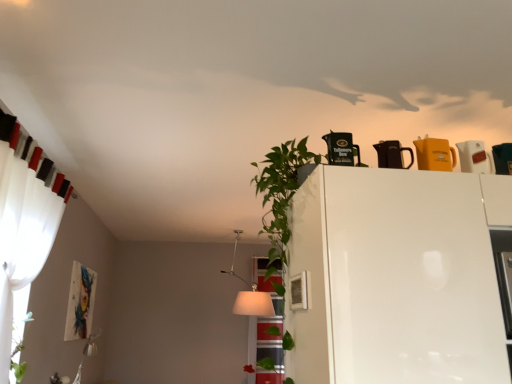
Question: Choose the correct answer: Is translucent glass window at center inside matte black kettle at upper center, which is counted as the 2th appliance, starting from the left, or outside it?

Choices:
 (A) inside
 (B) outside

Answer: (B)

Question: In terms of size, does translucent glass window at center appear bigger or smaller than matte black kettle at upper center, which is counted as the 2th appliance, starting from the left?

Choices:
 (A) big
 (B) small

Answer: (A)

Question: Considering the real-world distances, which object is farthest from the black plastic coffee pot at upper center, arranged as the 4th appliance when viewed from the right?

Choices:
 (A) matte black kettle at upper center, which ranks as the 3th appliance in right-to-left order
 (B) white sheer curtain at left
 (C) white glossy fridge at upper center
 (D) white glossy pitcher at upper right, placed as the fourth appliance when sorted from left to right
 (E) yellow matte pitcher at upper right, acting as the second appliance starting from the right

Answer: (B)

Question: Which of these objects is positioned farthest from the white sheer curtain at left?

Choices:
 (A) white glossy pitcher at upper right, placed as the fourth appliance when sorted from left to right
 (B) white fabric lampshade at center
 (C) translucent glass window at center
 (D) matte black kettle at upper center, which ranks as the 3th appliance in right-to-left order
 (E) yellow matte pitcher at upper right, acting as the second appliance starting from the right

Answer: (C)